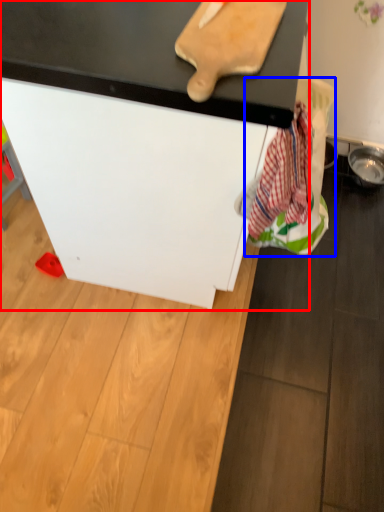
Question: Which point is closer to the camera, furniture (highlighted by a red box) or laundry (highlighted by a blue box)?

Choices:
 (A) furniture
 (B) laundry

Answer: (A)